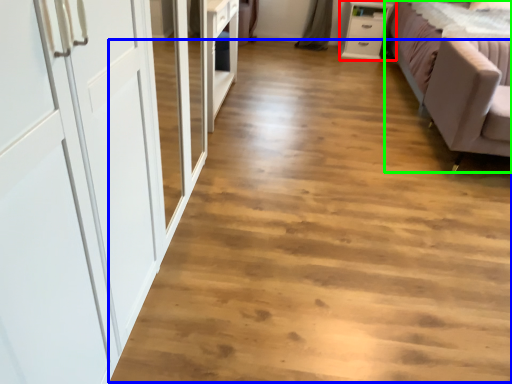
Question: Estimate the real-world distances between objects in this image. Which object is farther from chest of drawers (highlighted by a red box), plain (highlighted by a blue box) or studio couch (highlighted by a green box)?

Choices:
 (A) plain
 (B) studio couch

Answer: (A)